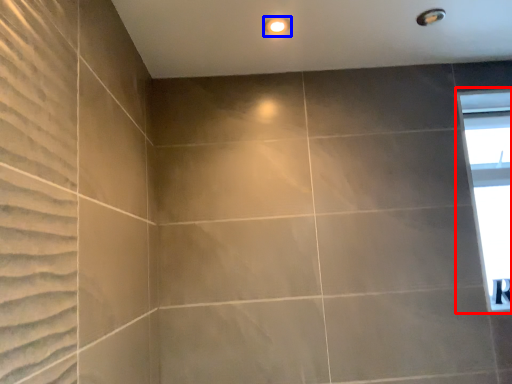
Question: Which point is further to the camera, window (highlighted by a red box) or lighting (highlighted by a blue box)?

Choices:
 (A) window
 (B) lighting

Answer: (A)